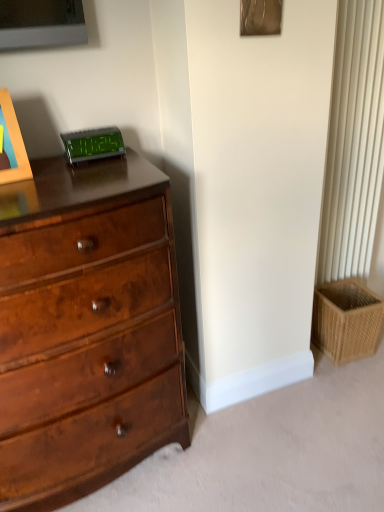
Question: Considering the relative positions of shiny brown wood chest of drawers at left and woven tan basket at lower right in the image provided, is shiny brown wood chest of drawers at left in front of woven tan basket at lower right?

Choices:
 (A) yes
 (B) no

Answer: (A)

Question: Is shiny brown wood chest of drawers at left directly adjacent to woven tan basket at lower right?

Choices:
 (A) yes
 (B) no

Answer: (B)

Question: Is woven tan basket at lower right a part of shiny brown wood chest of drawers at left?

Choices:
 (A) yes
 (B) no

Answer: (B)

Question: Are shiny brown wood chest of drawers at left and woven tan basket at lower right far apart?

Choices:
 (A) no
 (B) yes

Answer: (B)

Question: Considering the relative sizes of shiny brown wood chest of drawers at left and woven tan basket at lower right in the image provided, is shiny brown wood chest of drawers at left thinner than woven tan basket at lower right?

Choices:
 (A) no
 (B) yes

Answer: (A)

Question: From a real-world perspective, is green digital display at upper center physically located above or below woven tan basket at lower right?

Choices:
 (A) below
 (B) above

Answer: (B)

Question: From the image's perspective, is green digital display at upper center above or below woven tan basket at lower right?

Choices:
 (A) above
 (B) below

Answer: (A)

Question: In terms of height, does green digital display at upper center look taller or shorter compared to woven tan basket at lower right?

Choices:
 (A) short
 (B) tall

Answer: (A)

Question: Is green digital display at upper center to the left or to the right of woven tan basket at lower right in the image?

Choices:
 (A) right
 (B) left

Answer: (B)

Question: From the image's perspective, is woven tan basket at lower right located above or below shiny brown wood chest of drawers at left?

Choices:
 (A) below
 (B) above

Answer: (A)

Question: Is woven tan basket at lower right in front of or behind shiny brown wood chest of drawers at left in the image?

Choices:
 (A) front
 (B) behind

Answer: (B)

Question: Is woven tan basket at lower right bigger or smaller than shiny brown wood chest of drawers at left?

Choices:
 (A) big
 (B) small

Answer: (B)

Question: Is woven tan basket at lower right taller or shorter than shiny brown wood chest of drawers at left?

Choices:
 (A) short
 (B) tall

Answer: (A)

Question: In the image, is woven tan basket at lower right positioned in front of or behind green digital display at upper center?

Choices:
 (A) behind
 (B) front

Answer: (A)

Question: Looking at the image, does woven tan basket at lower right seem bigger or smaller compared to green digital display at upper center?

Choices:
 (A) small
 (B) big

Answer: (B)